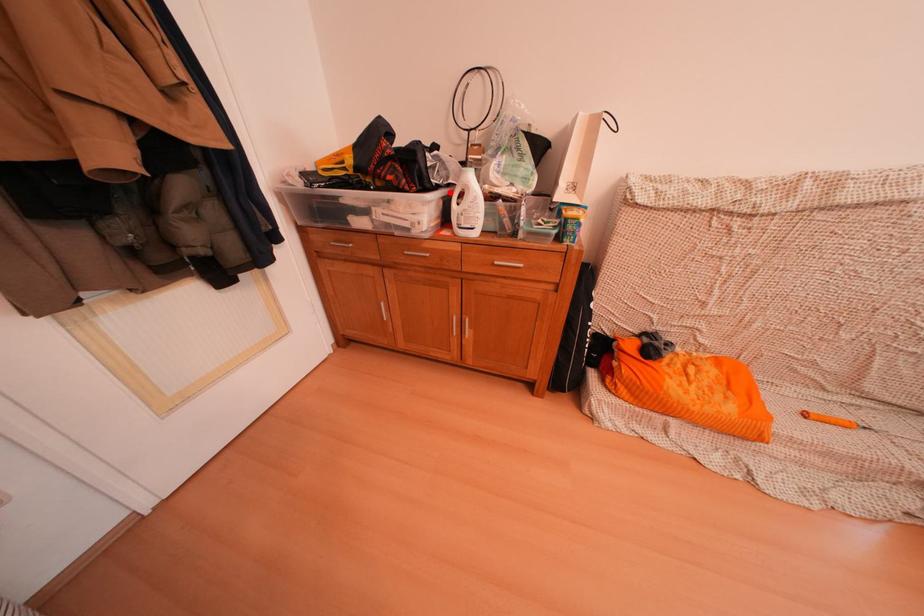
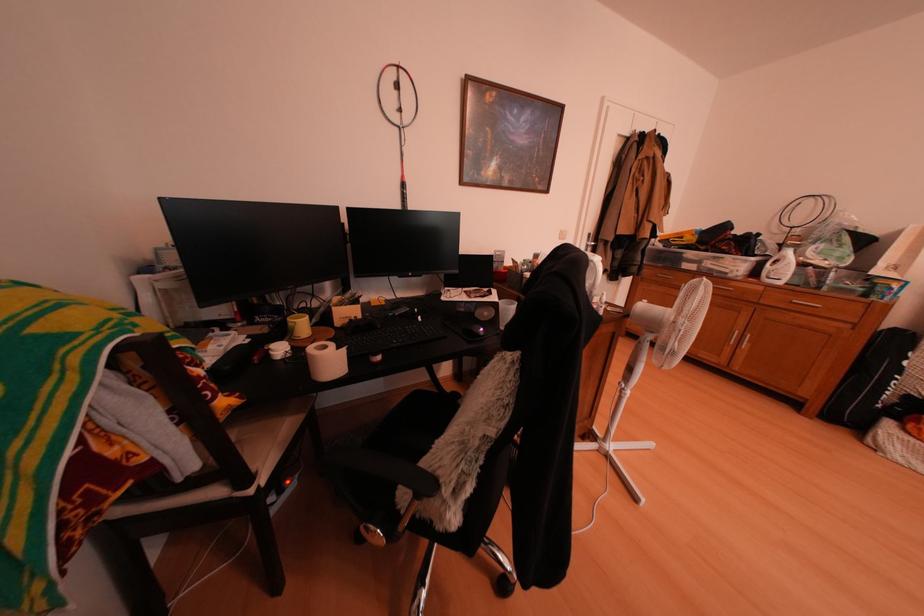
Question: I am providing you with two images of the same scene from different viewpoints. A red point is marked on the first image. Is the red point's position out of view in image 2?

Choices:
 (A) Yes
 (B) No

Answer: (B)